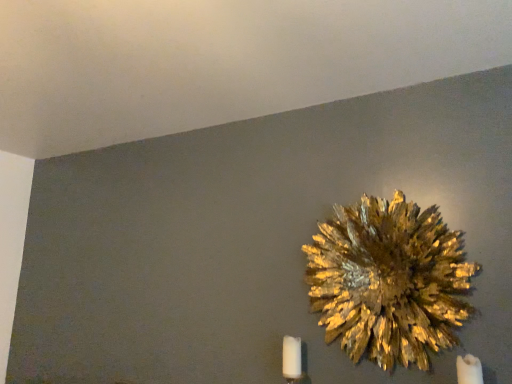
I want to click on white matte candle at lower right, positioned as the 1th candle in left-to-right order, so click(x=291, y=357).

Describe the element at coordinates (469, 370) in the screenshot. I see `white matte candle at lower right, the second candle from the back` at that location.

This screenshot has height=384, width=512. Find the location of `gold textured flower at upper right`. gold textured flower at upper right is located at coordinates (389, 281).

Where is `flower lying on the right of white matte candle at lower right, acting as the 1th candle starting from the back`? flower lying on the right of white matte candle at lower right, acting as the 1th candle starting from the back is located at coordinates (389, 281).

Could you tell me if gold textured flower at upper right is turned towards white matte candle at lower right, positioned as the 1th candle in left-to-right order?

No, gold textured flower at upper right is not aimed at white matte candle at lower right, positioned as the 1th candle in left-to-right order.

From the image's perspective, relative to white matte candle at lower right, positioned as the 1th candle in left-to-right order, is gold textured flower at upper right above or below?

Clearly, from the image's perspective, gold textured flower at upper right is above white matte candle at lower right, positioned as the 1th candle in left-to-right order.

Between gold textured flower at upper right and white matte candle at lower right, positioned as the 1th candle in left-to-right order, which one has larger width?

gold textured flower at upper right is wider.

Can you confirm if white matte candle at lower right, the second candle from the back, is taller than white matte candle at lower right, acting as the 2th candle starting from the right?

Indeed, white matte candle at lower right, the second candle from the back, has a greater height compared to white matte candle at lower right, acting as the 2th candle starting from the right.

From a real-world perspective, which is physically above, white matte candle at lower right, the first candle in the front-to-back sequence, or white matte candle at lower right, acting as the 1th candle starting from the back?

white matte candle at lower right, acting as the 1th candle starting from the back, is physically above.

Locate an element on the screen. candle beneath the white matte candle at lower right, positioned as the 1th candle in left-to-right order (from a real-world perspective) is located at coordinates (469, 370).

In the scene shown: Could you tell me if white matte candle at lower right, arranged as the 2th candle when viewed from the left, is turned towards white matte candle at lower right, acting as the 2th candle starting from the right?

No.

From the image's perspective, is white matte candle at lower right, arranged as the first candle when viewed from the right, beneath gold textured flower at upper right?

Yes, from the image's perspective, white matte candle at lower right, arranged as the first candle when viewed from the right, is beneath gold textured flower at upper right.

Is white matte candle at lower right, the second candle from the back, aimed at gold textured flower at upper right?

No.

Is white matte candle at lower right, arranged as the first candle when viewed from the right, wider or thinner than gold textured flower at upper right?

Considering their sizes, white matte candle at lower right, arranged as the first candle when viewed from the right, looks broader than gold textured flower at upper right.

Can we say white matte candle at lower right, arranged as the first candle when viewed from the right, lies outside gold textured flower at upper right?

Yes, white matte candle at lower right, arranged as the first candle when viewed from the right, is outside of gold textured flower at upper right.

In the scene shown: Is gold textured flower at upper right further to the viewer compared to white matte candle at lower right, the second candle from the back?

Yes, gold textured flower at upper right is behind white matte candle at lower right, the second candle from the back.

The image size is (512, 384). Identify the location of flower on the left of the white matte candle at lower right, the second candle from the back. [x=389, y=281].

From a real-world perspective, is gold textured flower at upper right positioned above or below white matte candle at lower right, the first candle in the front-to-back sequence?

From a real-world perspective, gold textured flower at upper right is physically above white matte candle at lower right, the first candle in the front-to-back sequence.

Does point (336, 319) come farther from viewer compared to point (469, 362)?

Yes, point (336, 319) is behind point (469, 362).

Who is more distant, white matte candle at lower right, the 2th candle positioned from the front, or gold textured flower at upper right?

Positioned behind is white matte candle at lower right, the 2th candle positioned from the front.

Considering the points (291, 375) and (466, 283), which point is in front, point (291, 375) or point (466, 283)?

Point (466, 283)

Is white matte candle at lower right, acting as the 1th candle starting from the back, inside the boundaries of gold textured flower at upper right, or outside?

white matte candle at lower right, acting as the 1th candle starting from the back, is located beyond the bounds of gold textured flower at upper right.

Is white matte candle at lower right, positioned as the 1th candle in left-to-right order, with gold textured flower at upper right?

No, white matte candle at lower right, positioned as the 1th candle in left-to-right order, is not with gold textured flower at upper right.

This screenshot has width=512, height=384. Identify the location of candle behind the white matte candle at lower right, arranged as the 2th candle when viewed from the left. (291, 357).

Is white matte candle at lower right, positioned as the 1th candle in left-to-right order, surrounding white matte candle at lower right, the first candle in the front-to-back sequence?

Definitely not — white matte candle at lower right, the first candle in the front-to-back sequence, is not inside white matte candle at lower right, positioned as the 1th candle in left-to-right order.

Which object is thinner, white matte candle at lower right, acting as the 1th candle starting from the back, or white matte candle at lower right, the first candle in the front-to-back sequence?

Thinner between the two is white matte candle at lower right, acting as the 1th candle starting from the back.

In the image, is white matte candle at lower right, acting as the 1th candle starting from the back, positioned in front of or behind white matte candle at lower right, arranged as the first candle when viewed from the right?

Clearly, white matte candle at lower right, acting as the 1th candle starting from the back, is behind white matte candle at lower right, arranged as the first candle when viewed from the right.

This screenshot has height=384, width=512. Find the location of `flower to the right of white matte candle at lower right, the 2th candle positioned from the front`. flower to the right of white matte candle at lower right, the 2th candle positioned from the front is located at coordinates (389, 281).

Locate an element on the screen. This screenshot has width=512, height=384. candle behind the white matte candle at lower right, arranged as the first candle when viewed from the right is located at coordinates (291, 357).

Looking at the image, which one is located further to white matte candle at lower right, the first candle in the front-to-back sequence, white matte candle at lower right, acting as the 2th candle starting from the right, or gold textured flower at upper right?

white matte candle at lower right, acting as the 2th candle starting from the right.

Which object lies further to the anchor point gold textured flower at upper right, white matte candle at lower right, the first candle in the front-to-back sequence, or white matte candle at lower right, positioned as the 1th candle in left-to-right order?

white matte candle at lower right, positioned as the 1th candle in left-to-right order, lies further to gold textured flower at upper right than the other object.

Considering their positions, is gold textured flower at upper right positioned further to white matte candle at lower right, the 2th candle positioned from the front, than white matte candle at lower right, the first candle in the front-to-back sequence?

white matte candle at lower right, the first candle in the front-to-back sequence, lies further to white matte candle at lower right, the 2th candle positioned from the front, than the other object.

Looking at the image, which one is located further to white matte candle at lower right, arranged as the first candle when viewed from the right, gold textured flower at upper right or white matte candle at lower right, acting as the 1th candle starting from the back?

Based on the image, white matte candle at lower right, acting as the 1th candle starting from the back, appears to be further to white matte candle at lower right, arranged as the first candle when viewed from the right.

When comparing their distances from gold textured flower at upper right, does white matte candle at lower right, the 2th candle positioned from the front, or white matte candle at lower right, the second candle from the back, seem further?

→ white matte candle at lower right, the 2th candle positioned from the front.

From the image, which object appears to be farther from white matte candle at lower right, acting as the 1th candle starting from the back, white matte candle at lower right, arranged as the 2th candle when viewed from the left, or gold textured flower at upper right?

white matte candle at lower right, arranged as the 2th candle when viewed from the left, is positioned further to the anchor white matte candle at lower right, acting as the 1th candle starting from the back.

Locate an element on the screen. The image size is (512, 384). flower between white matte candle at lower right, positioned as the 1th candle in left-to-right order, and white matte candle at lower right, arranged as the 2th candle when viewed from the left, in the horizontal direction is located at coordinates (389, 281).